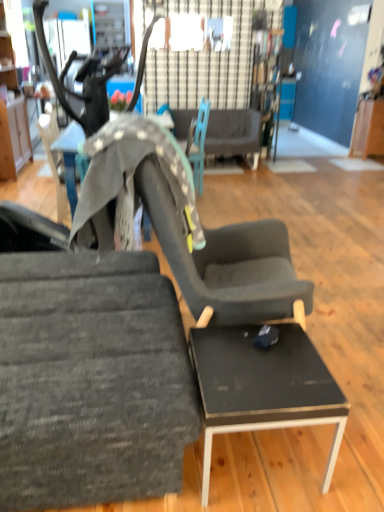
The height and width of the screenshot is (512, 384). Find the location of `empty space that is ontop of black glossy table at lower right (from a real-world perspective)`. empty space that is ontop of black glossy table at lower right (from a real-world perspective) is located at coordinates (262, 361).